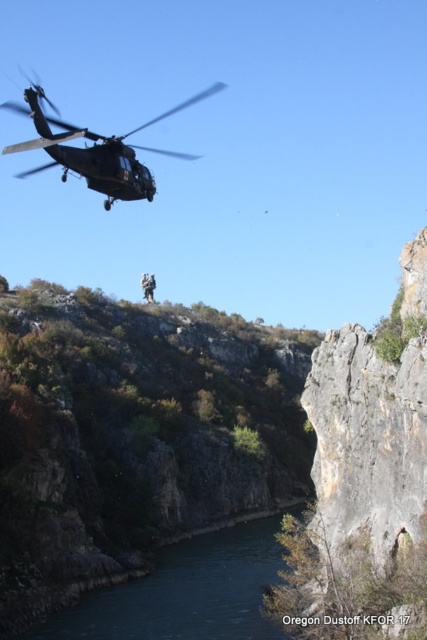
Question: Is matte black helicopter at upper left positioned in front of camouflage fabric soldier at upper center?

Choices:
 (A) no
 (B) yes

Answer: (B)

Question: Observing the image, what is the correct spatial positioning of green leafy hillside at upper center in reference to blue smooth water at lower center?

Choices:
 (A) above
 (B) below

Answer: (A)

Question: Which point is closer to the camera taking this photo?

Choices:
 (A) (160, 604)
 (B) (149, 298)

Answer: (A)

Question: Which point is closer to the camera?

Choices:
 (A) (155, 285)
 (B) (113, 166)
 (C) (102, 632)

Answer: (B)

Question: Can you confirm if matte black helicopter at upper left is smaller than camouflage fabric soldier at upper center?

Choices:
 (A) no
 (B) yes

Answer: (A)

Question: Based on their relative distances, which object is farther from the matte black helicopter at upper left?

Choices:
 (A) blue smooth water at lower center
 (B) green leafy hillside at upper center
 (C) camouflage fabric soldier at upper center

Answer: (C)